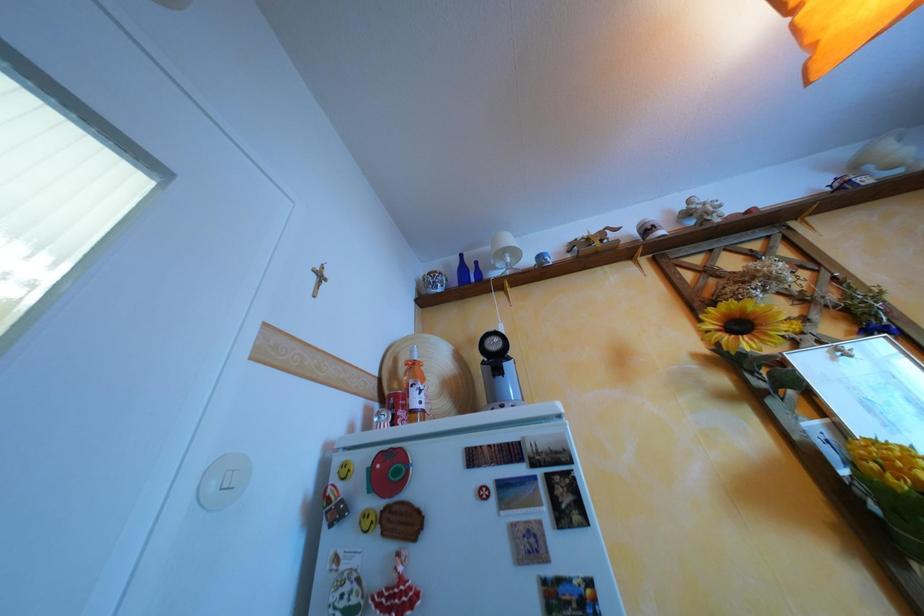
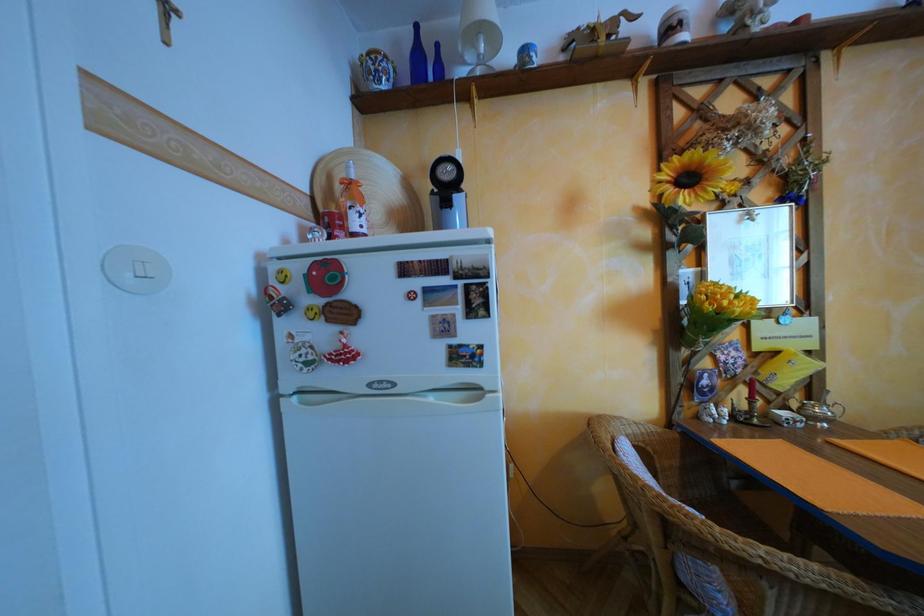
Question: The first image is from the beginning of the video and the second image is from the end. How did the camera likely rotate when shooting the video?

Choices:
 (A) Left
 (B) Right
 (C) Up
 (D) Down

Answer: (D)